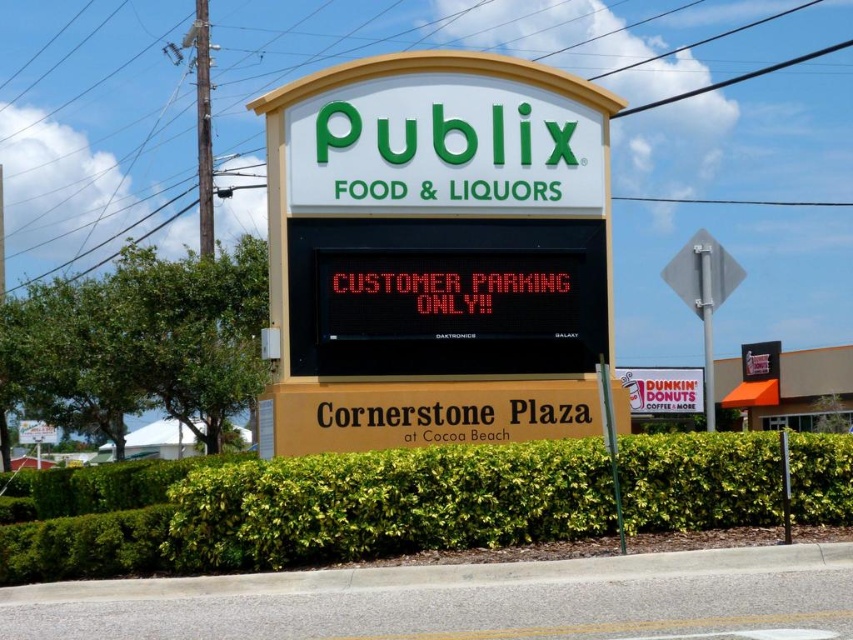
You are a customer trying to park your car in the Publix parking lot. You see a yellow matte sign at center and a green leafy hedge at center. Which object is wider?

The yellow matte sign at center is less wide than the green leafy hedge at center, so the green leafy hedge at center is wider.

In the scene shown: What is located at the point with coordinates (436, 253) on the Publix Food and Liquors signboard?

The yellow matte sign at center is located at the point with coordinates (436, 253) on the Publix Food and Liquors signboard.

Okay, let me try to work through this. The user provided a scene description of a Publix signboard with a digital screen and some objects. The objects here are just a single point at coordinates (555,413). The objects description says that this point is 40.50 feet away from the viewer. First, I need to create a question based on the rules. The question must mention the object label exactly as given, which is

Okay, let me try to work through this. The user provided a scene description of a Publix signboard with a digital screen and some objects. The objects here are just a single point at coordinates (555,413). The objects description says that this point is 40.50 feet away from the viewer. First, I need to create a question based on the rules. The question must mention the object label exactly as given, which is